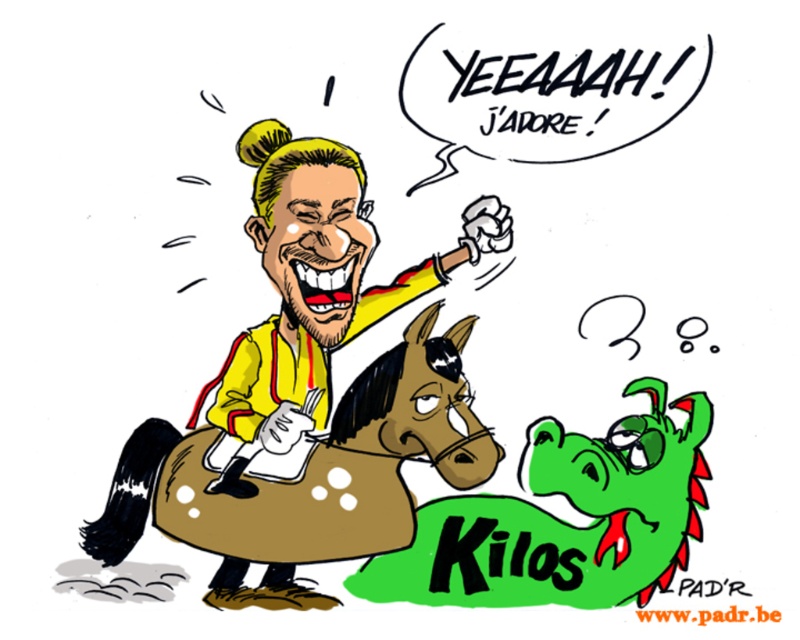
Question: Which point is farther to the camera?

Choices:
 (A) pyautogui.click(x=456, y=353)
 (B) pyautogui.click(x=250, y=237)

Answer: (A)

Question: Which point is farther to the camera?

Choices:
 (A) (285, 436)
 (B) (258, 550)

Answer: (B)

Question: Can you confirm if brown leather horse at center is wider than yellow matte jacket at center?

Choices:
 (A) yes
 (B) no

Answer: (A)

Question: Can you confirm if brown leather horse at center is smaller than yellow matte jacket at center?

Choices:
 (A) no
 (B) yes

Answer: (B)

Question: Is the position of brown leather horse at center more distant than that of yellow matte jacket at center?

Choices:
 (A) no
 (B) yes

Answer: (B)